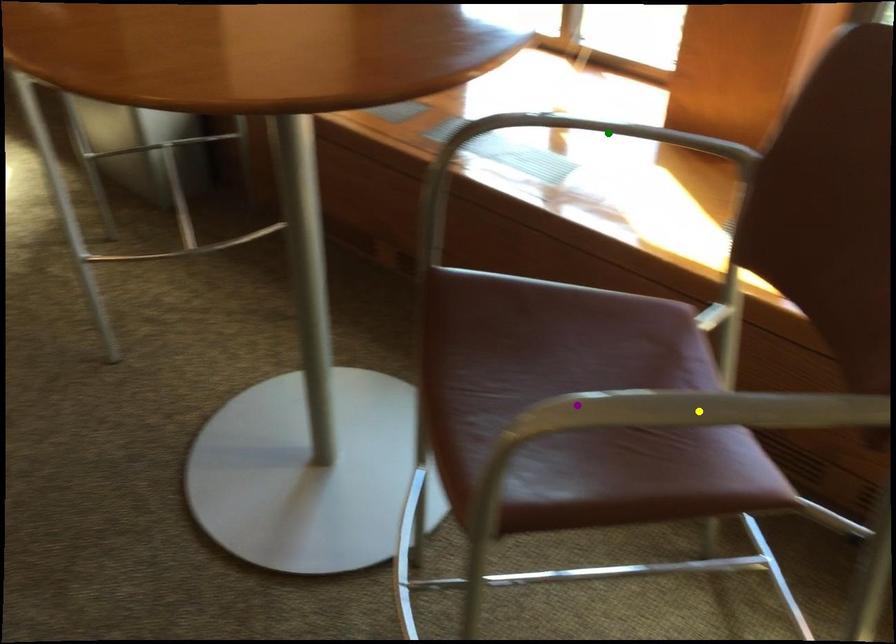
Order these from nearest to farthest:
yellow point
purple point
green point

yellow point < purple point < green point